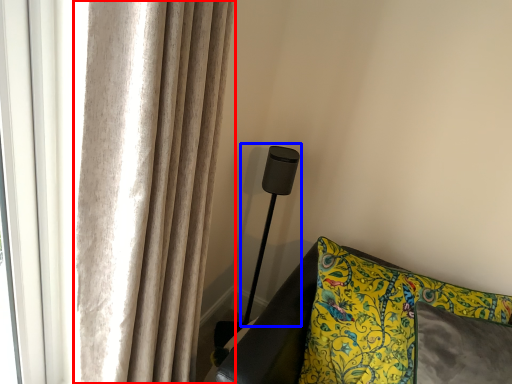
Question: Which of the following is the closest to the observer, curtain (highlighted by a red box) or table lamp (highlighted by a blue box)?

Choices:
 (A) curtain
 (B) table lamp

Answer: (A)